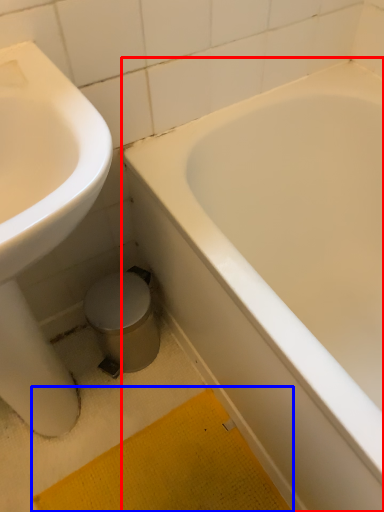
Question: Which object appears closest to the camera in this image, bathtub (highlighted by a red box) or bath mat (highlighted by a blue box)?

Choices:
 (A) bathtub
 (B) bath mat

Answer: (A)